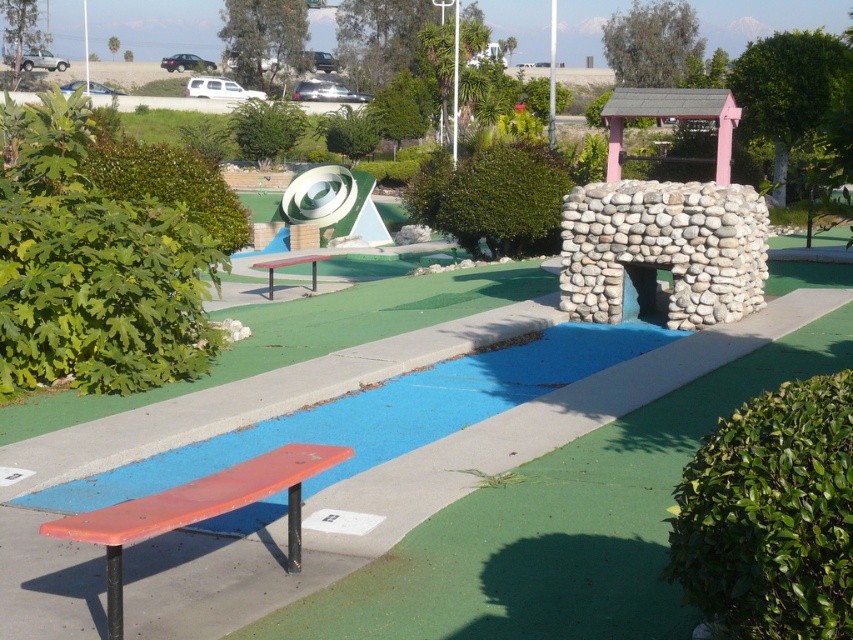
Question: Can you confirm if matte orange bench at lower left is thinner than red painted wood bench at center?

Choices:
 (A) yes
 (B) no

Answer: (B)

Question: Is matte orange bench at lower left wider than red painted wood bench at center?

Choices:
 (A) no
 (B) yes

Answer: (B)

Question: Does matte orange bench at lower left have a lesser width compared to red painted wood bench at center?

Choices:
 (A) yes
 (B) no

Answer: (B)

Question: Which object appears closest to the camera in this image?

Choices:
 (A) red painted wood bench at center
 (B) matte orange bench at lower left

Answer: (B)

Question: Which point is farther from the camera taking this photo?

Choices:
 (A) (297, 259)
 (B) (303, 477)

Answer: (A)